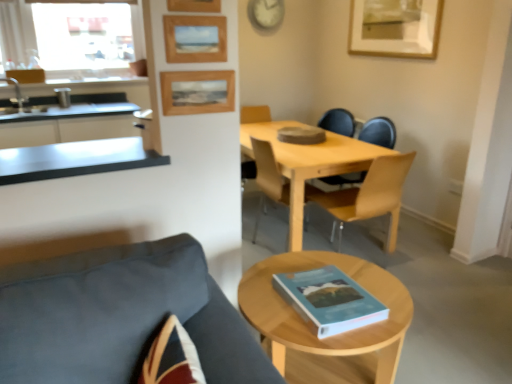
Where is `empty space that is ontop of light wood coffee table at center (from a real-world perspective)`? This screenshot has height=384, width=512. empty space that is ontop of light wood coffee table at center (from a real-world perspective) is located at coordinates (326, 266).